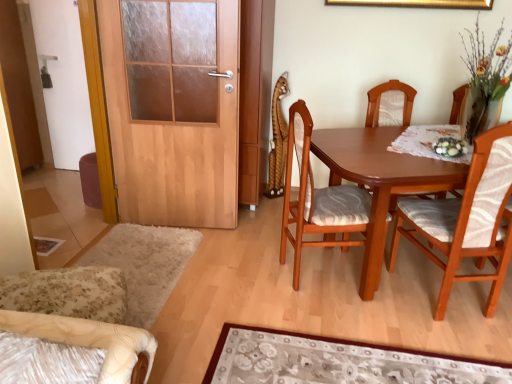
Identify the location of vacant space in between wooden chair with patterned cushion at right, arranged as the first chair when viewed from the right, and wooden chair with patterned cushion at center, positioned as the third chair in right-to-left order. The width and height of the screenshot is (512, 384). (380, 288).